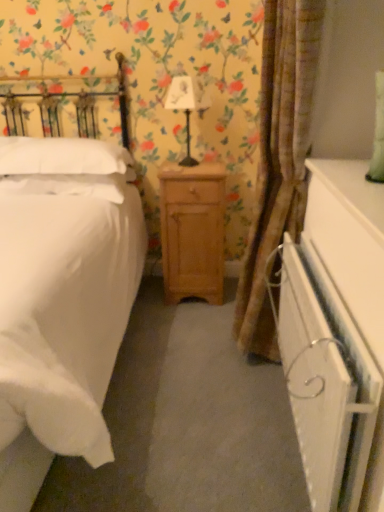
The image size is (384, 512). Find the location of `space that is in front of brown textured curtain at center`. space that is in front of brown textured curtain at center is located at coordinates coord(220,453).